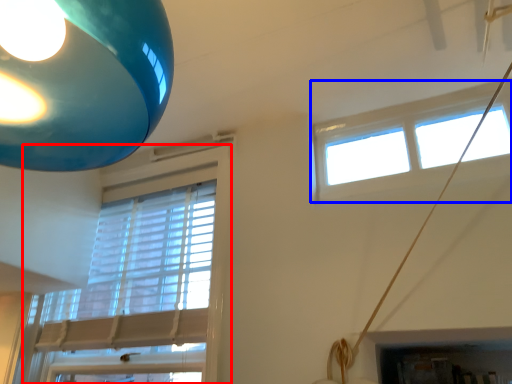
Question: Which point is closer to the camera, window (highlighted by a red box) or window (highlighted by a blue box)?

Choices:
 (A) window
 (B) window

Answer: (B)